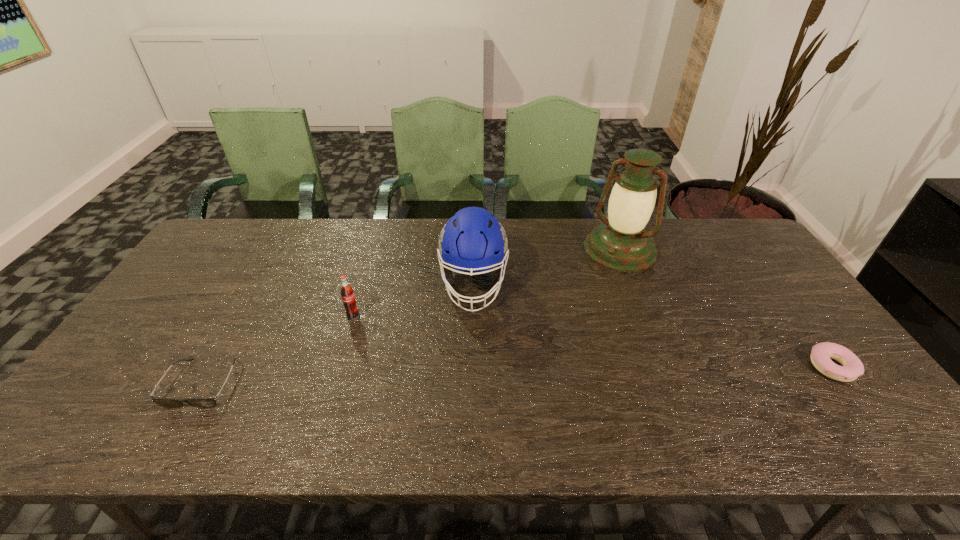
The height and width of the screenshot is (540, 960). I want to click on sunglasses located in the near edge section of the desktop, so click(164, 402).

This screenshot has height=540, width=960. Identify the location of doughnut located at the near edge. (822, 353).

Locate an element on the screen. object at the right edge is located at coordinates (822, 353).

Find the location of a particular element. object that is at the near right corner is located at coordinates (822, 353).

This screenshot has height=540, width=960. I want to click on vacant space at the far edge of the desktop, so click(688, 261).

This screenshot has height=540, width=960. I want to click on free region at the near edge of the desktop, so click(x=577, y=397).

Image resolution: width=960 pixels, height=540 pixels. Identify the location of vacant space at the left edge of the desktop. (x=239, y=267).

This screenshot has width=960, height=540. I want to click on blank space at the right edge, so pyautogui.click(x=781, y=350).

What are the coordinates of `free region at the far left corner of the desktop` in the screenshot? It's located at (260, 235).

The width and height of the screenshot is (960, 540). In order to click on free region at the far right corner in this screenshot , I will do `click(735, 222)`.